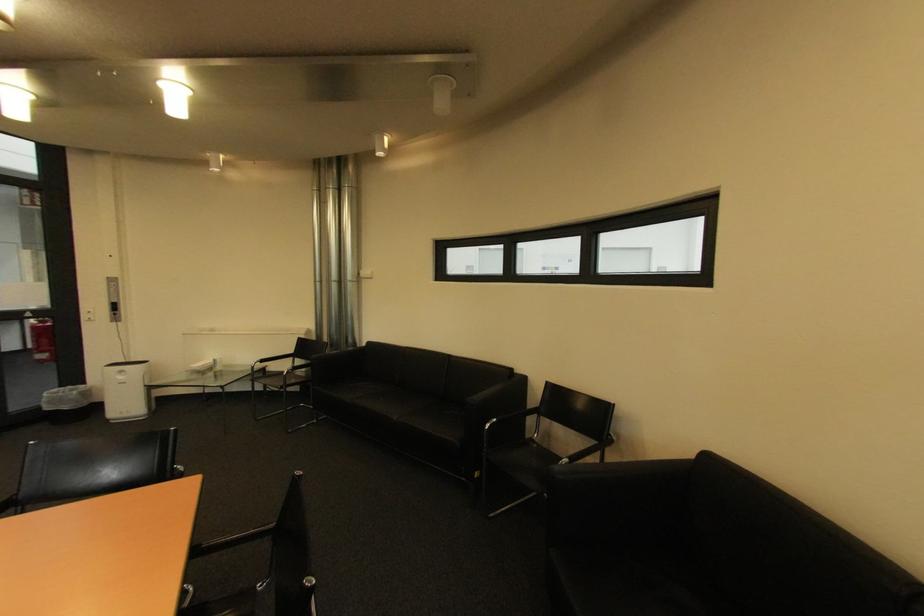
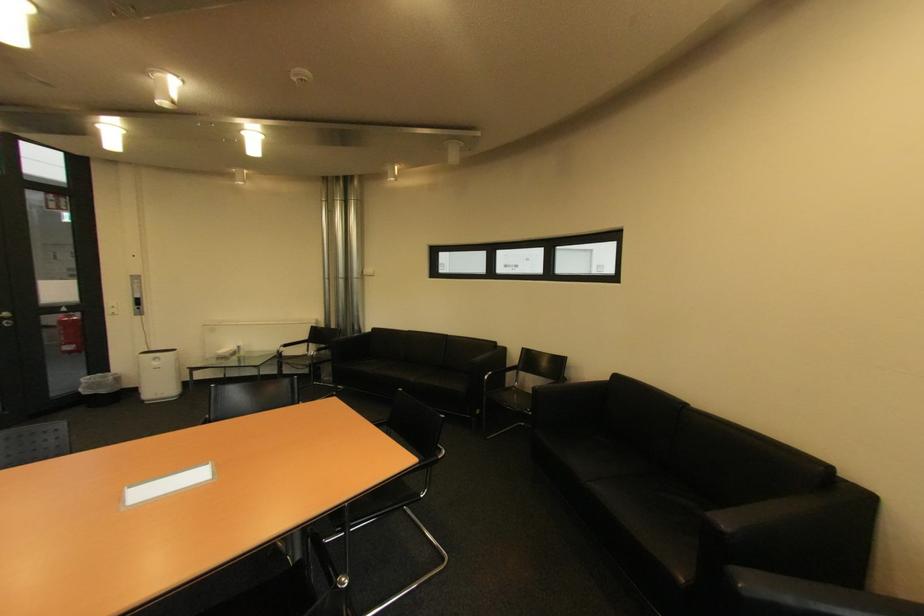
Locate, in the second image, the point that corresponds to the point at 117,286 in the first image.

(140, 283)